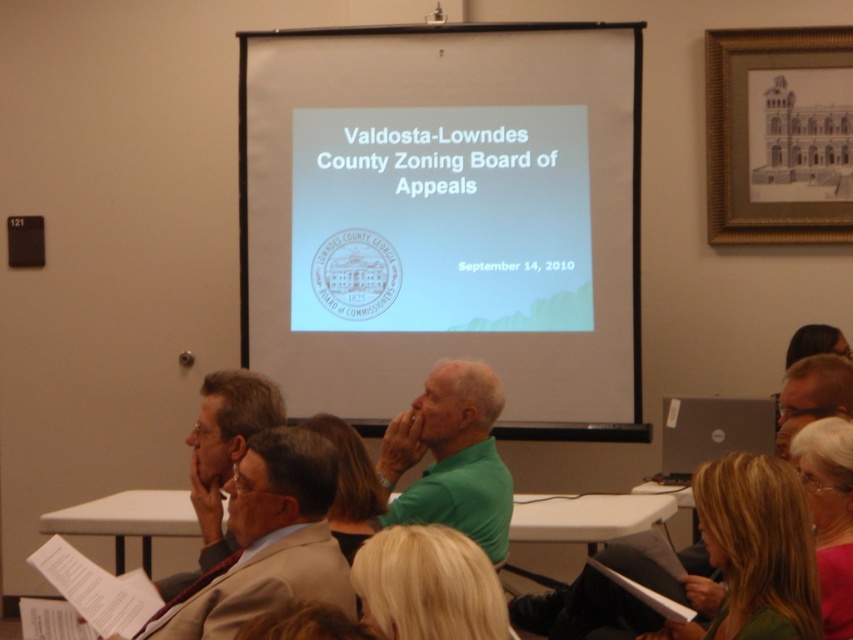
You are standing in the room where the meeting is taking place. There is a point marked at coordinates (463,595). If you want to move to that point, will you need to move forward, backward, left, or right?

The point at (463,595) is 4.93 feet away from you, so you will need to move forward to reach it.